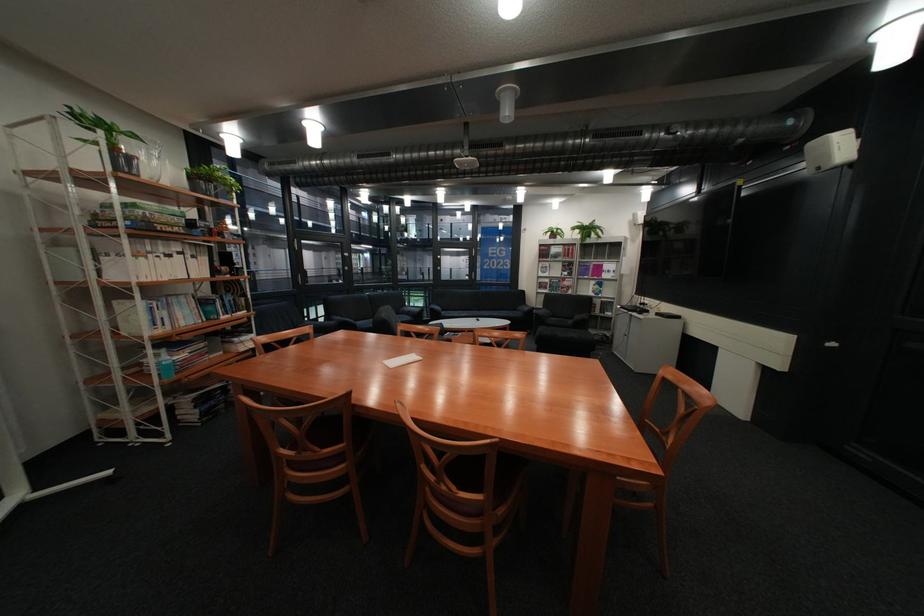
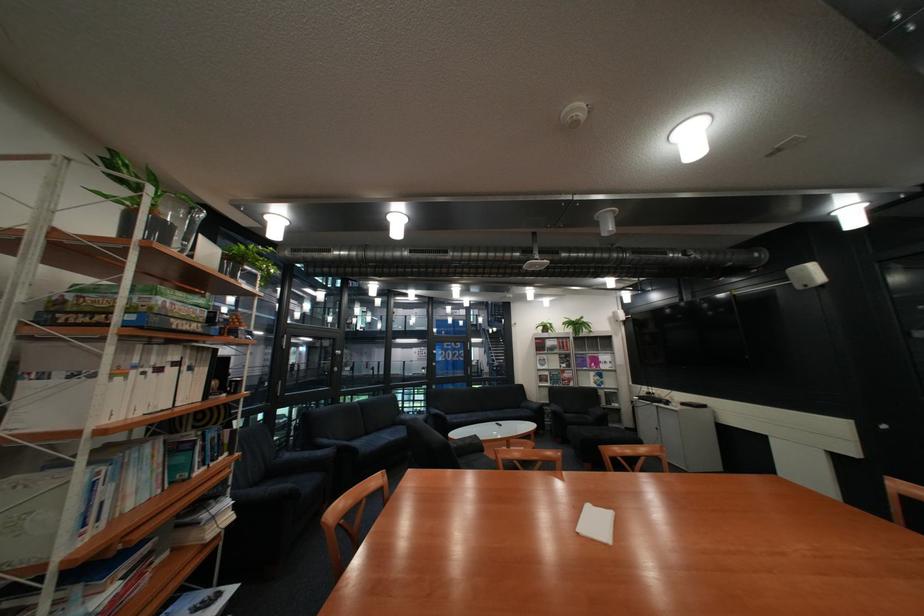
The images are taken continuously from a first-person perspective. In which direction are you moving?

The cameraman walked toward left, forward.